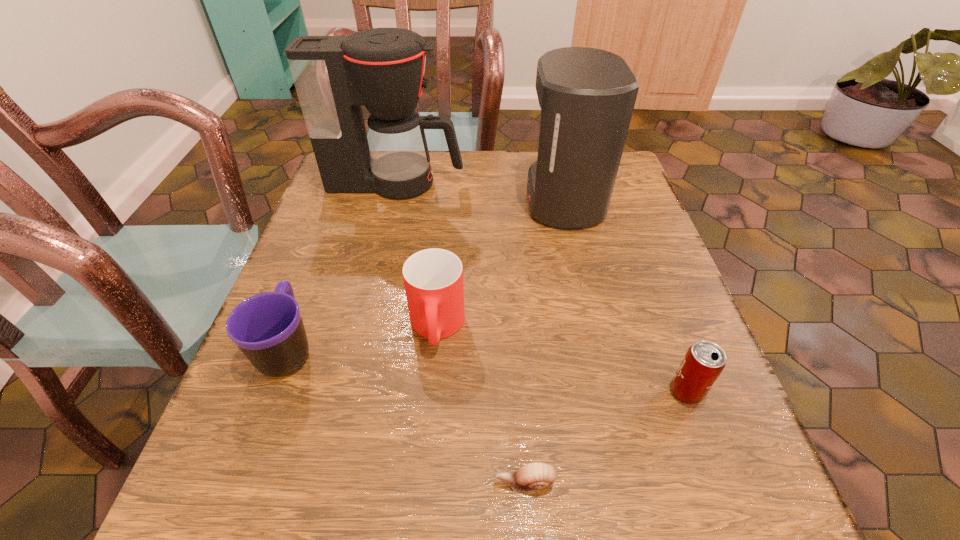
I want to click on coffee maker present at the left edge, so click(x=382, y=69).

This screenshot has width=960, height=540. In order to click on mug that is at the left edge in this screenshot , I will do `click(267, 327)`.

I want to click on coffee maker that is at the right edge, so click(x=587, y=96).

Identify the location of beer can positioned at the right edge. This screenshot has width=960, height=540. (704, 361).

Where is `object positioned at the far left corner`? This screenshot has width=960, height=540. object positioned at the far left corner is located at coordinates (382, 69).

Where is `object positioned at the far right corner`? object positioned at the far right corner is located at coordinates (587, 96).

Identify the location of free space at the far edge of the desktop. (448, 166).

You are a GUI agent. You are given a task and a screenshot of the screen. Output one action in this format:
    pyautogui.click(x=<x>, y=<y>)
    Task: Click on the free space at the near edge
    
    Given the screenshot: What is the action you would take?
    pyautogui.click(x=589, y=513)

Find the location of a particular element. This screenshot has height=540, width=960. free space at the left edge is located at coordinates (343, 321).

Locate an element on the screen. free location at the right edge of the desktop is located at coordinates (649, 227).